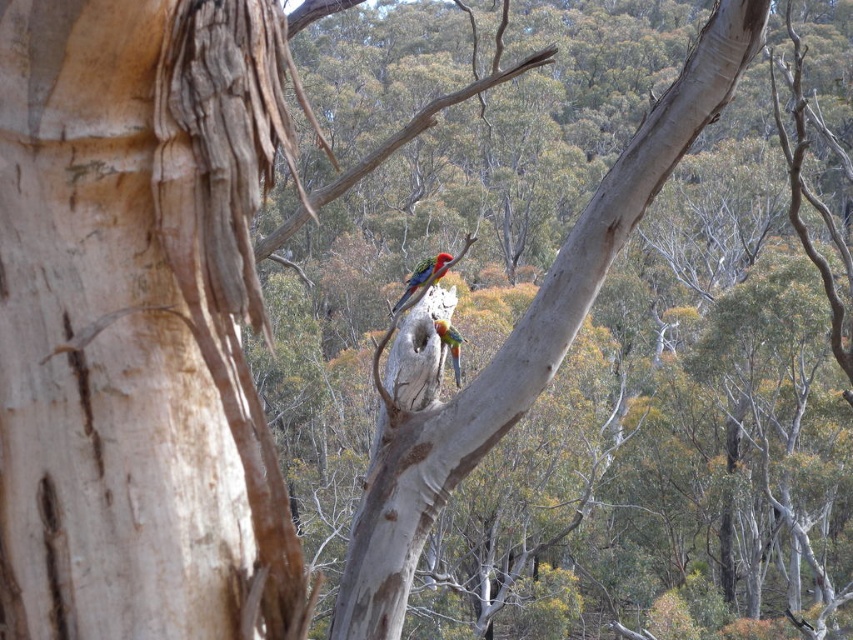
Question: Is smooth white bark at left thinner than smooth bark tree at center?

Choices:
 (A) yes
 (B) no

Answer: (A)

Question: Which point is farther to the camera?

Choices:
 (A) shiny multicolored parrot at center
 (B) smooth bark tree at center
 (C) multicolored glossy parrot at center
 (D) smooth white bark at left

Answer: (C)

Question: Is smooth white bark at left further to the viewer compared to shiny multicolored parrot at center?

Choices:
 (A) yes
 (B) no

Answer: (B)

Question: Which object appears farthest from the camera in this image?

Choices:
 (A) smooth white bark at left
 (B) smooth bark tree at center
 (C) multicolored glossy parrot at center
 (D) shiny multicolored parrot at center

Answer: (C)

Question: Is smooth white bark at left positioned before shiny multicolored parrot at center?

Choices:
 (A) no
 (B) yes

Answer: (B)

Question: Which point is closer to the camera?

Choices:
 (A) (640, 125)
 (B) (136, 618)
 (C) (444, 324)
 (D) (444, 262)

Answer: (B)